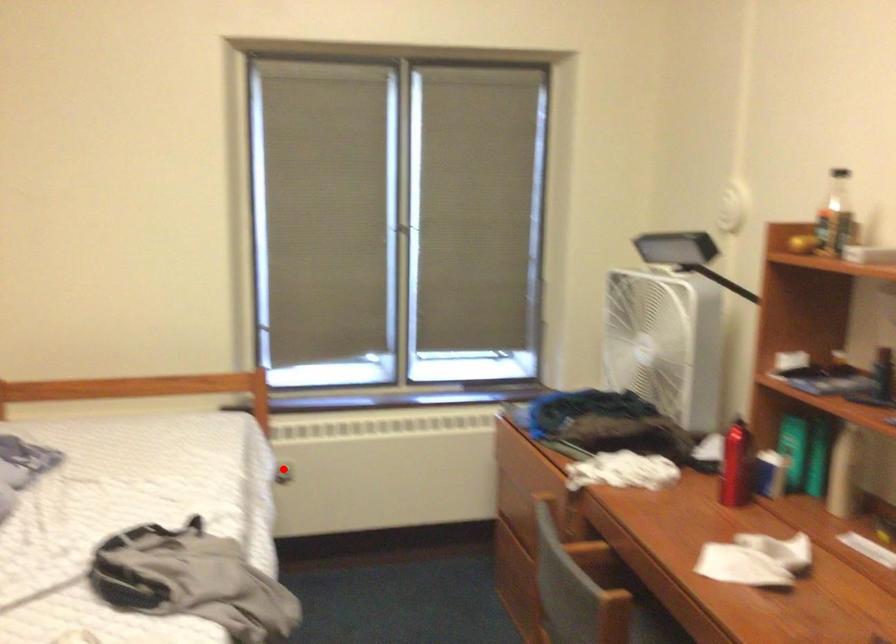
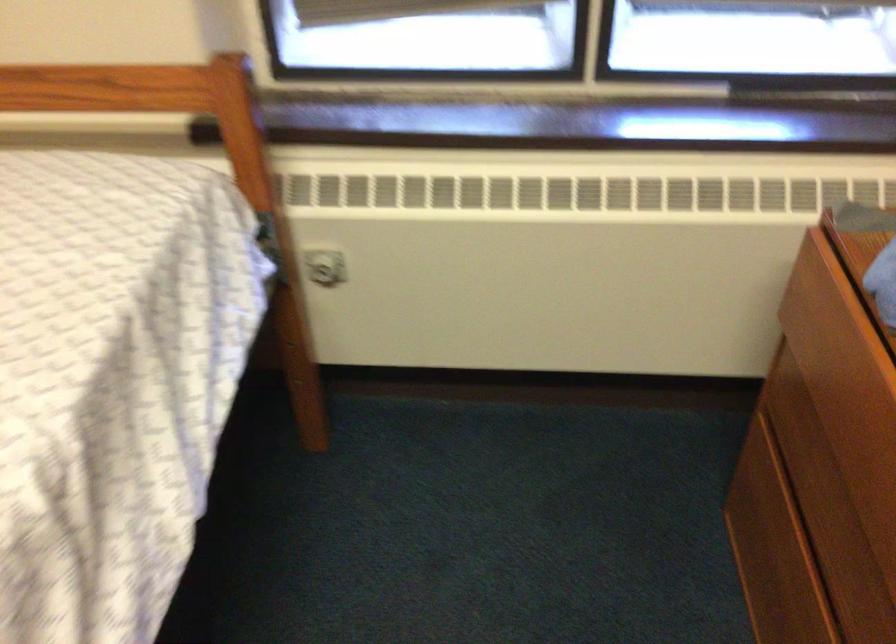
Question: A red point is marked in image1. In image2, is the corresponding 3D point closer to the camera or farther? Reply with the corresponding letter.

Choices:
 (A) The corresponding 3D point is closer.
 (B) The corresponding 3D point is farther.

Answer: (A)